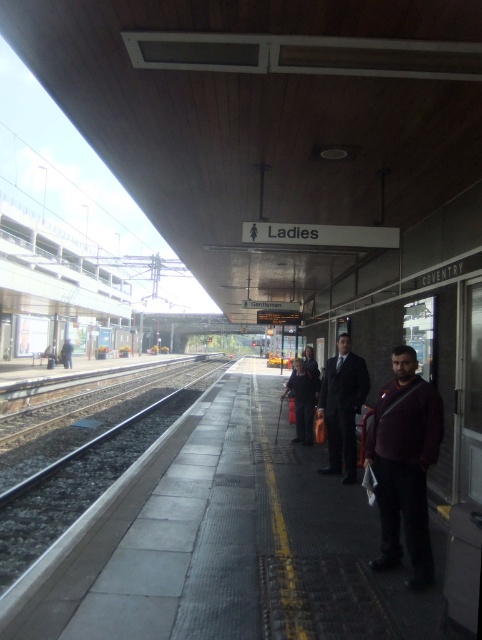
Between maroon fabric jacket at center and dark suit at center, which one appears on the left side from the viewer's perspective?

maroon fabric jacket at center

Can you confirm if maroon fabric jacket at center is positioned to the right of dark suit at center?

Incorrect, maroon fabric jacket at center is not on the right side of dark suit at center.

Does point (425, 513) lie in front of point (325, 419)?

Yes, point (425, 513) is in front of point (325, 419).

You are a GUI agent. You are given a task and a screenshot of the screen. Output one action in this format:
    pyautogui.click(x=<x>, y=<y>)
    Task: Click on the maroon fabric jacket at center
    The height and width of the screenshot is (640, 482).
    Given the screenshot: What is the action you would take?
    [404, 465]